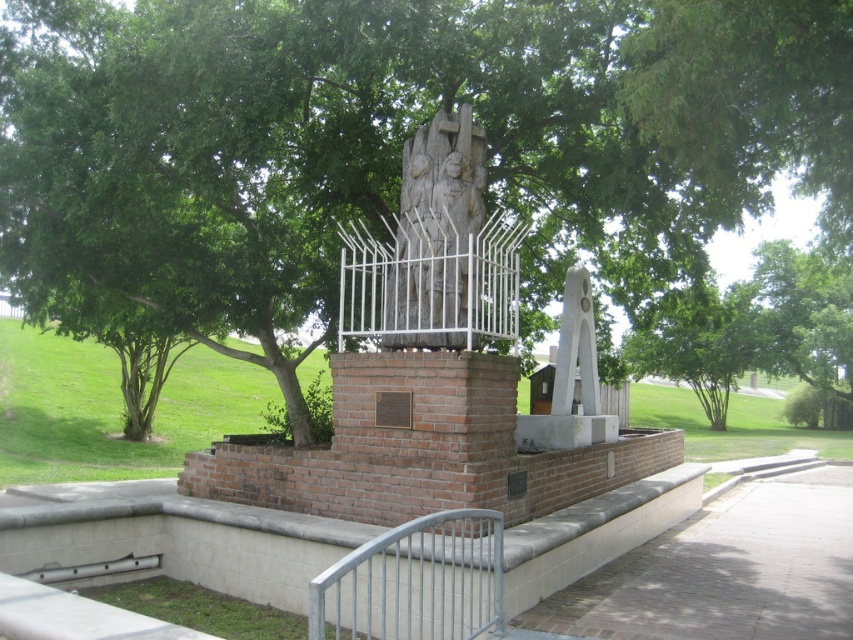
Question: Which point is farther to the camera?

Choices:
 (A) (566, 1)
 (B) (570, 344)

Answer: (B)

Question: Is green leafy tree at center below carved stone sculpture at center?

Choices:
 (A) no
 (B) yes

Answer: (B)

Question: Does green leafy tree at center have a lesser width compared to silver metallic fence at lower center?

Choices:
 (A) yes
 (B) no

Answer: (B)

Question: Does green leafy tree at center appear on the left side of carved stone sculpture at center?

Choices:
 (A) yes
 (B) no

Answer: (B)

Question: Which point is closer to the camera?

Choices:
 (A) white metal fence at center
 (B) silver metallic fence at lower center

Answer: (B)

Question: Which object is the closest to the green leafy tree at center?

Choices:
 (A) white metal fence at center
 (B) white marble clock at center
 (C) carved stone sculpture at center

Answer: (A)